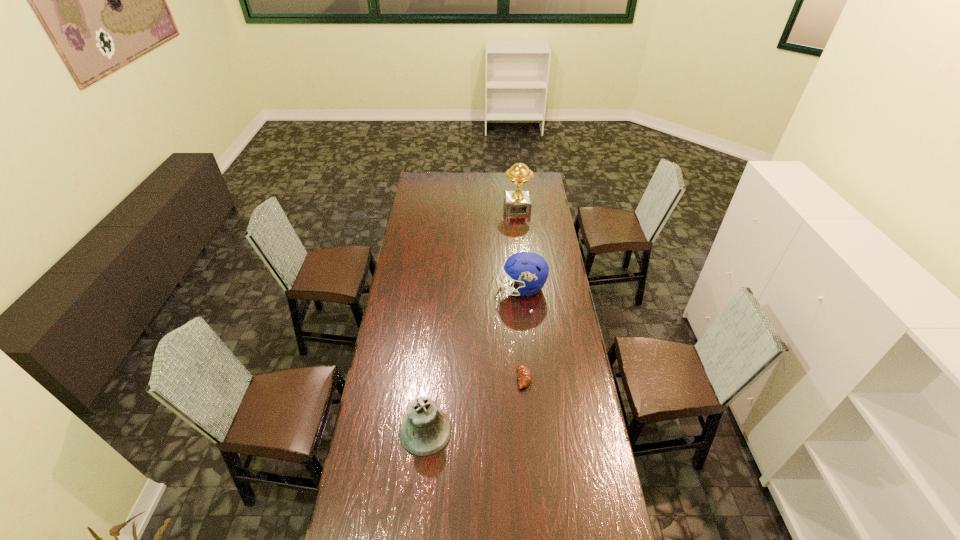
The width and height of the screenshot is (960, 540). Identify the location of free space located on the front-facing side of the third nearest object. (485, 288).

Identify the location of free space located 0.220m on the front of the bell. The height and width of the screenshot is (540, 960). (417, 524).

Where is `free point located on the left of the crescent roll`? The height and width of the screenshot is (540, 960). free point located on the left of the crescent roll is located at coordinates (419, 378).

The height and width of the screenshot is (540, 960). What are the coordinates of `object that is at the left edge` in the screenshot? It's located at (426, 430).

Image resolution: width=960 pixels, height=540 pixels. Find the location of `award positioned at the right edge`. award positioned at the right edge is located at coordinates (517, 202).

Identify the location of football helmet located at the right edge. Image resolution: width=960 pixels, height=540 pixels. (529, 270).

At what (x,y) coordinates should I click in order to perform the action: click on vacant space at the far edge of the desktop. Please return your answer as a coordinate pair (x, y). This screenshot has width=960, height=540. Looking at the image, I should click on (453, 172).

Where is `free region at the left edge`? Image resolution: width=960 pixels, height=540 pixels. free region at the left edge is located at coordinates (415, 194).

At what (x,y) coordinates should I click in order to perform the action: click on free space at the right edge. Please return your answer as a coordinate pair (x, y). The height and width of the screenshot is (540, 960). Looking at the image, I should click on [580, 429].

In the image, there is a desktop. Where is `vacant space at the far left corner`? vacant space at the far left corner is located at coordinates (433, 190).